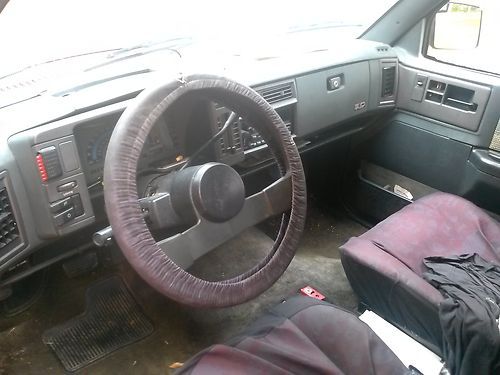
Locate an element on the screen. This screenshot has width=500, height=375. floor mat is located at coordinates (125, 319), (72, 339).